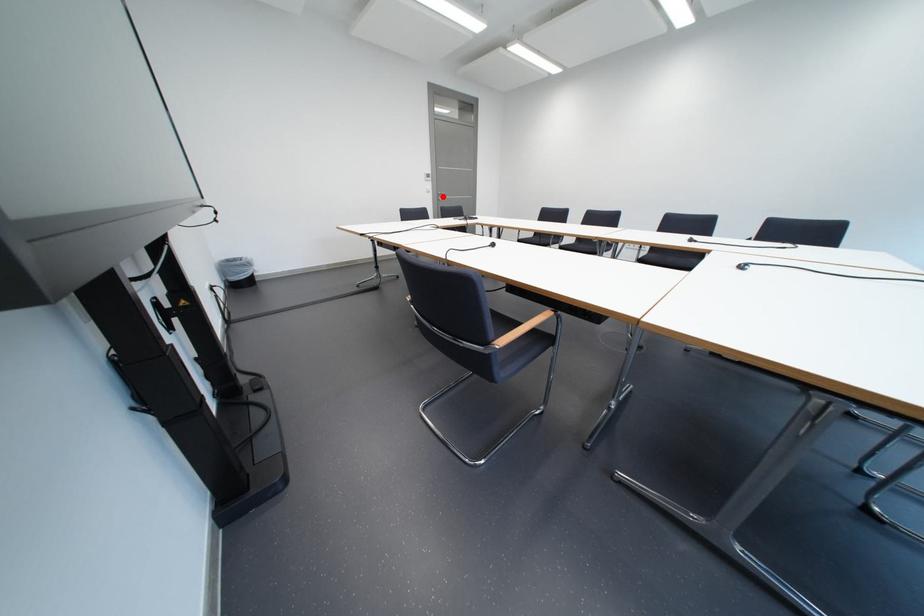
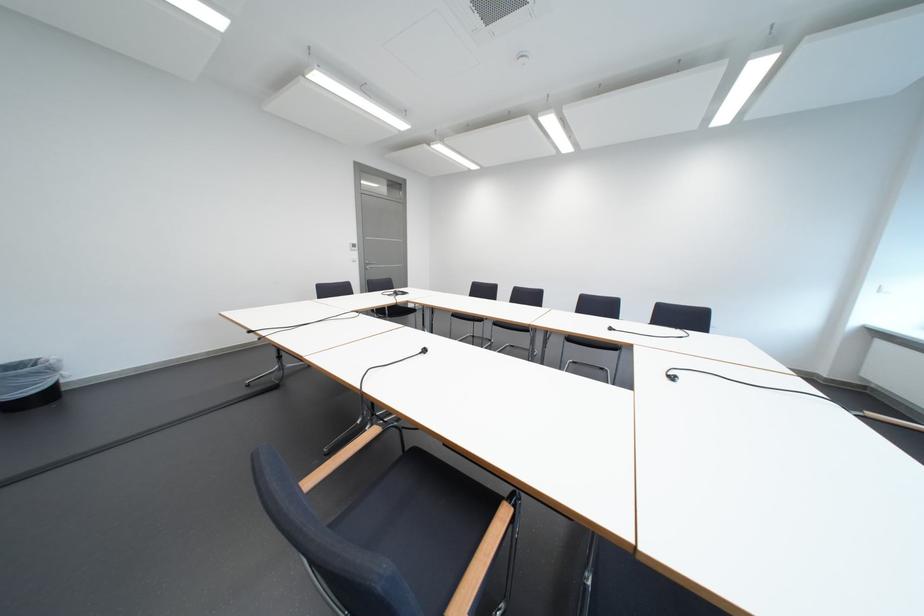
Where in the second image is the point corresponding to the highlighted location from the first image?

(369, 265)